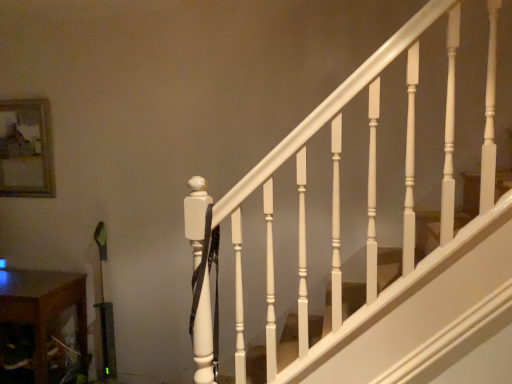
Question: From the image's perspective, is wooden at lower left below wooden frame at upper left?

Choices:
 (A) yes
 (B) no

Answer: (A)

Question: Could you tell me if wooden at lower left is facing wooden frame at upper left?

Choices:
 (A) no
 (B) yes

Answer: (A)

Question: Is wooden at lower left outside wooden frame at upper left?

Choices:
 (A) no
 (B) yes

Answer: (B)

Question: Is the depth of wooden at lower left greater than that of wooden frame at upper left?

Choices:
 (A) no
 (B) yes

Answer: (A)

Question: Would you say wooden frame at upper left is part of wooden at lower left's contents?

Choices:
 (A) no
 (B) yes

Answer: (A)

Question: From a real-world perspective, does wooden at lower left stand above wooden frame at upper left?

Choices:
 (A) yes
 (B) no

Answer: (B)

Question: Does wooden frame at upper left contain wooden at lower left?

Choices:
 (A) no
 (B) yes

Answer: (A)

Question: Can you confirm if wooden frame at upper left is bigger than wooden at lower left?

Choices:
 (A) no
 (B) yes

Answer: (A)

Question: Can you confirm if wooden frame at upper left is taller than wooden at lower left?

Choices:
 (A) yes
 (B) no

Answer: (B)

Question: From a real-world perspective, is wooden frame at upper left on top of wooden at lower left?

Choices:
 (A) yes
 (B) no

Answer: (A)

Question: Can you confirm if wooden frame at upper left is smaller than wooden at lower left?

Choices:
 (A) no
 (B) yes

Answer: (B)

Question: From the image's perspective, would you say wooden frame at upper left is shown under wooden at lower left?

Choices:
 (A) no
 (B) yes

Answer: (A)

Question: From their relative heights in the image, would you say wooden at lower left is taller or shorter than wooden frame at upper left?

Choices:
 (A) tall
 (B) short

Answer: (A)